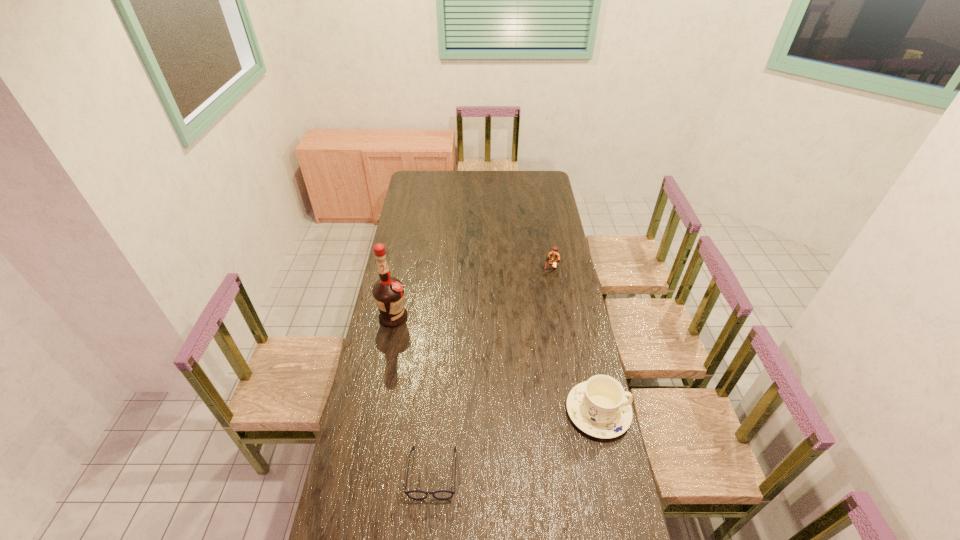
This screenshot has height=540, width=960. I want to click on the second object from left to right, so click(414, 494).

Find the location of a particular element. This screenshot has height=540, width=960. spectacles is located at coordinates (414, 494).

At what (x,y) coordinates should I click in order to perform the action: click on chinaware. Please return your answer as a coordinate pair (x, y). Looking at the image, I should click on (599, 407).

Locate an element on the screen. the leftmost object is located at coordinates (388, 292).

Locate an element on the screen. The image size is (960, 540). liquor is located at coordinates (388, 292).

At what (x,y) coordinates should I click in order to perform the action: click on the farthest object. Please return your answer as a coordinate pair (x, y). Image resolution: width=960 pixels, height=540 pixels. Looking at the image, I should click on (554, 258).

The image size is (960, 540). I want to click on free location located on the front-facing side of the nearest object, so tap(429, 527).

Find the location of a particular element. The width and height of the screenshot is (960, 540). vacant position located on the front and back of the leftmost object is located at coordinates (453, 363).

The image size is (960, 540). Identify the location of free space located on the front and back of the leftmost object. (467, 374).

This screenshot has height=540, width=960. Find the location of `blank space located 0.120m on the front and back of the leftmost object`. blank space located 0.120m on the front and back of the leftmost object is located at coordinates (421, 339).